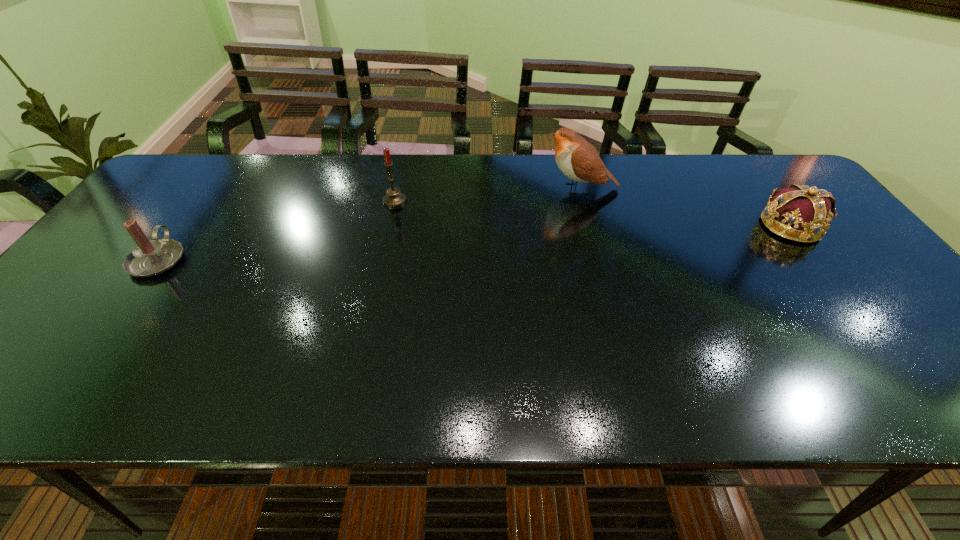
At what (x,y) coordinates should I click in order to perform the action: click on vacant space at the left edge of the desktop. Please return your answer as a coordinate pair (x, y). This screenshot has height=540, width=960. Looking at the image, I should click on (39, 339).

At what (x,y) coordinates should I click in order to perform the action: click on free space at the right edge of the desktop. Please return your answer as a coordinate pair (x, y). This screenshot has height=540, width=960. Looking at the image, I should click on (839, 271).

The image size is (960, 540). I want to click on blank space at the far right corner of the desktop, so click(x=755, y=168).

Locate an element on the screen. The height and width of the screenshot is (540, 960). free region at the near right corner of the desktop is located at coordinates point(948,401).

Where is `free space that is in between the rightmost object and the taller candle`? The height and width of the screenshot is (540, 960). free space that is in between the rightmost object and the taller candle is located at coordinates (592, 213).

Find the location of a particular element. This screenshot has width=960, height=540. empty space between the rightmost object and the taller candle is located at coordinates tap(592, 213).

Locate an element on the screen. blank region between the leftmost object and the right candle is located at coordinates (276, 230).

Identify the location of vacant space in between the farther candle and the shorter candle. This screenshot has width=960, height=540. (276, 230).

Where is `empty space between the crown and the left candle`? Image resolution: width=960 pixels, height=540 pixels. empty space between the crown and the left candle is located at coordinates (474, 242).

At what (x,y) coordinates should I click in order to perform the action: click on free point between the second object from left to right and the crown. Please return your answer as a coordinate pair (x, y). The image size is (960, 540). Looking at the image, I should click on (592, 213).